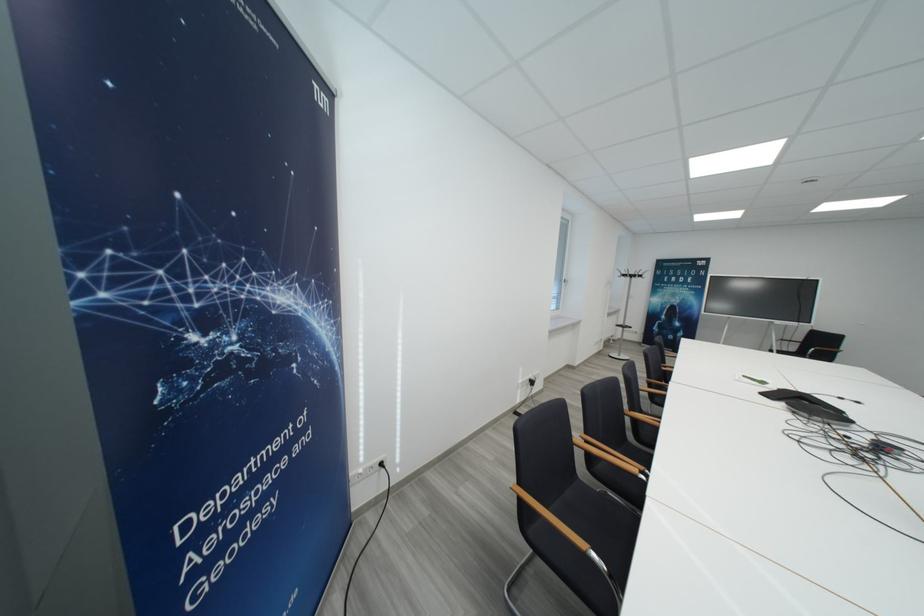
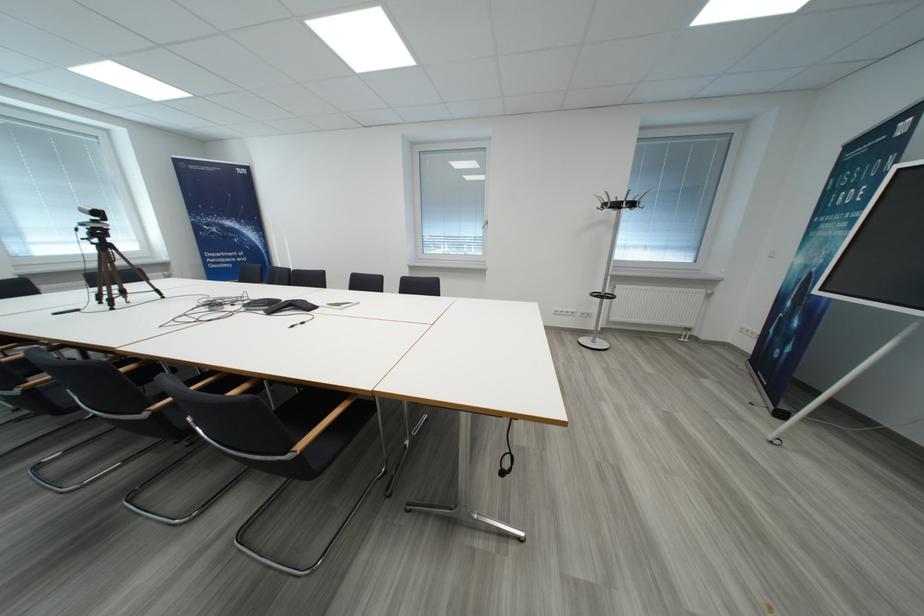
Locate, in the second image, the point that corresponds to point (648, 280) in the first image.

(623, 208)